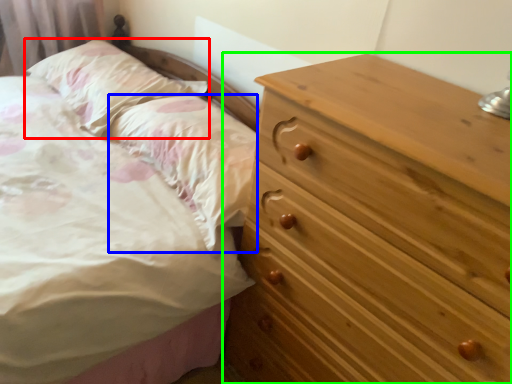
Question: Which object is the farthest from pillow (highlighted by a red box)? Choose among these: pillow (highlighted by a blue box) or chest of drawers (highlighted by a green box).

Choices:
 (A) pillow
 (B) chest of drawers

Answer: (B)